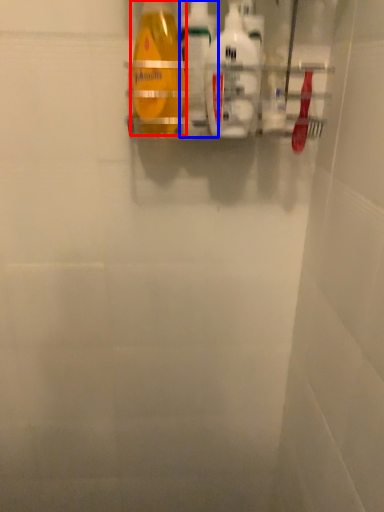
Question: Which object appears closest to the camera in this image, bottle (highlighted by a red box) or cleaning product (highlighted by a blue box)?

Choices:
 (A) bottle
 (B) cleaning product

Answer: (A)